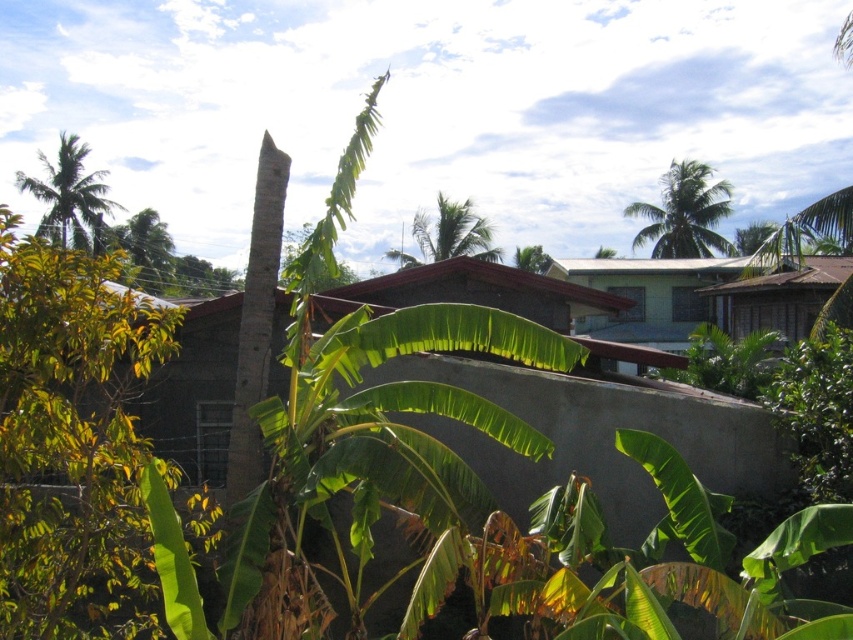
Which is below, brown wooden hut at upper right or green leafy palm tree at upper center?

brown wooden hut at upper right is lower down.

Who is positioned more to the left, brown wooden hut at upper right or green leafy palm tree at upper center?

green leafy palm tree at upper center

Between point (786, 292) and point (412, 218), which one is positioned in front?

Positioned in front is point (786, 292).

Find the location of a particular element. The image size is (853, 640). brown wooden hut at upper right is located at coordinates (776, 298).

Does brown wooden hut at upper right appear on the right side of green leafy palm tree at upper left?

Yes, brown wooden hut at upper right is to the right of green leafy palm tree at upper left.

Which is behind, point (807, 316) or point (80, 156)?

Positioned behind is point (80, 156).

The image size is (853, 640). What are the coordinates of `brown wooden hut at upper right` in the screenshot? It's located at (776, 298).

Does point (682, 257) come closer to viewer compared to point (430, 234)?

Yes, point (682, 257) is closer to viewer.

Which is above, green leafy palm tree at upper right or green leafy palm tree at upper center?

green leafy palm tree at upper right

The width and height of the screenshot is (853, 640). What are the coordinates of `green leafy palm tree at upper right` in the screenshot? It's located at (683, 212).